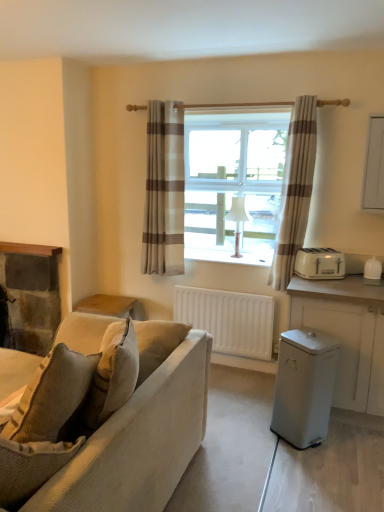
Question: Is white plastic toaster at right, placed as the 2th appliance when sorted from bottom to top, closer to the viewer compared to beige striped curtain at center, arranged as the first curtain when viewed from the left?

Choices:
 (A) yes
 (B) no

Answer: (A)

Question: From the image's perspective, does white plastic toaster at right, positioned as the 1th appliance in top-to-bottom order, appear lower than beige striped curtain at center, arranged as the first curtain when viewed from the left?

Choices:
 (A) yes
 (B) no

Answer: (A)

Question: Would you consider white plastic toaster at right, the first appliance when ordered from back to front, to be distant from beige striped curtain at center, arranged as the first curtain when viewed from the left?

Choices:
 (A) no
 (B) yes

Answer: (B)

Question: Is white plastic toaster at right, positioned as the 1th appliance in top-to-bottom order, facing towards beige striped curtain at center, the second curtain positioned from the right?

Choices:
 (A) no
 (B) yes

Answer: (A)

Question: Is white plastic toaster at right, which appears as the 2th appliance when viewed from the front, not within beige striped curtain at center, arranged as the first curtain when viewed from the left?

Choices:
 (A) yes
 (B) no

Answer: (A)

Question: Is white plastic toaster at right, the first appliance when ordered from back to front, facing away from beige striped curtain at center, the second curtain positioned from the right?

Choices:
 (A) no
 (B) yes

Answer: (A)

Question: From the image's perspective, is beige striped curtain at center, arranged as the first curtain when viewed from the left, under textured beige couch at left?

Choices:
 (A) no
 (B) yes

Answer: (A)

Question: Is beige striped curtain at center, the second curtain positioned from the right, turned away from textured beige couch at left?

Choices:
 (A) yes
 (B) no

Answer: (B)

Question: Are beige striped curtain at center, arranged as the first curtain when viewed from the left, and textured beige couch at left located far from each other?

Choices:
 (A) no
 (B) yes

Answer: (B)

Question: From a real-world perspective, is beige striped curtain at center, the second curtain positioned from the right, on top of textured beige couch at left?

Choices:
 (A) no
 (B) yes

Answer: (B)

Question: Is beige striped curtain at center, arranged as the first curtain when viewed from the left, at the right side of textured beige couch at left?

Choices:
 (A) no
 (B) yes

Answer: (B)

Question: Does beige striped curtain at center, arranged as the first curtain when viewed from the left, have a smaller size compared to textured beige couch at left?

Choices:
 (A) yes
 (B) no

Answer: (A)

Question: Is white matte radiator at center in contact with white matte cabinet at right?

Choices:
 (A) yes
 (B) no

Answer: (B)